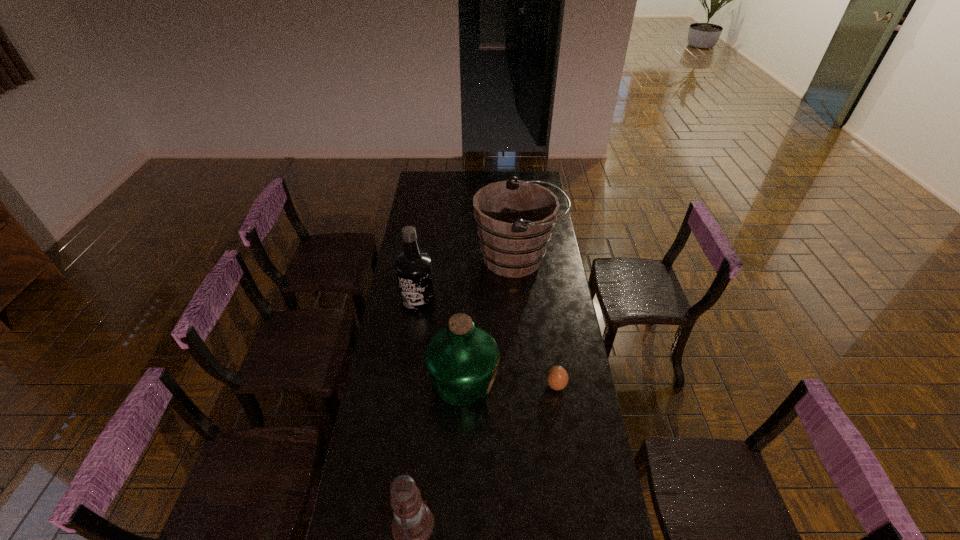
Image resolution: width=960 pixels, height=540 pixels. What are the coordinates of `the taller liquor` in the screenshot? It's located at (413, 267).

Find the location of a particular element. This screenshot has width=960, height=540. the fourth nearest object is located at coordinates (413, 267).

What are the coordinates of `bucket` in the screenshot? It's located at (514, 218).

I want to click on the shorter liquor, so click(x=461, y=360).

The image size is (960, 540). In order to click on the shortest object in this screenshot , I will do `click(557, 378)`.

Identify the location of free space located on the front label of the fourth nearest object. The image size is (960, 540). (413, 336).

Identify the location of free space located 0.150m on the label side of the shorter liquor. This screenshot has width=960, height=540. (538, 381).

Locate an element on the screen. free space located on the back of the shortest object is located at coordinates (548, 330).

Locate an element on the screen. The height and width of the screenshot is (540, 960). object present at the left edge is located at coordinates (413, 267).

Identify the location of bucket that is at the right edge. This screenshot has height=540, width=960. (514, 218).